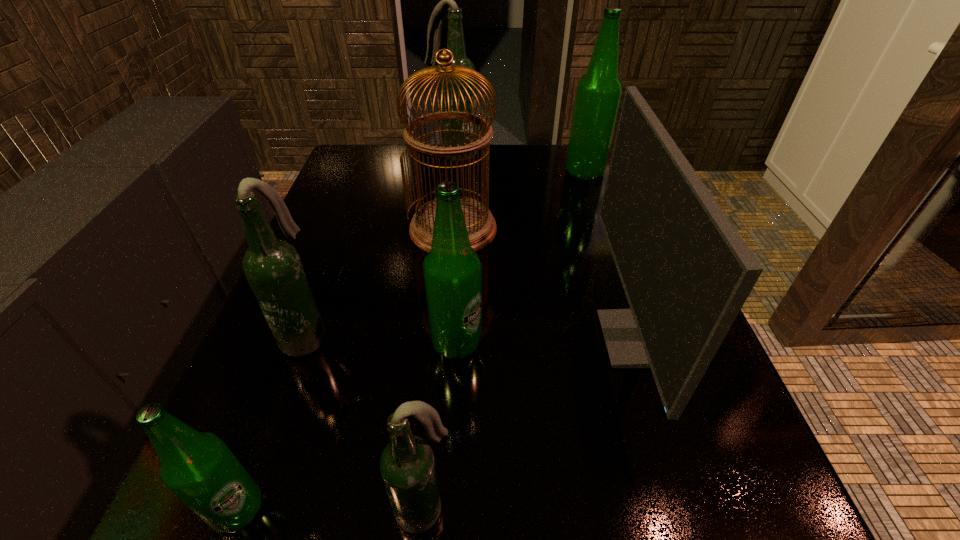
Image resolution: width=960 pixels, height=540 pixels. I want to click on the leftmost green beer bottle, so click(197, 467).

Where is `the nearest dark beer bottle`? This screenshot has height=540, width=960. the nearest dark beer bottle is located at coordinates (407, 465).

Locate an element on the screen. Image resolution: width=960 pixels, height=540 pixels. blank space located 0.300m on the front of the biggest dark beer bottle is located at coordinates (446, 231).

This screenshot has width=960, height=540. What are the coordinates of `vacant region located 0.140m on the label of the rightmost beer bottle` in the screenshot? It's located at (511, 173).

Locate an element on the screen. This screenshot has height=540, width=960. vacant space located on the label of the rightmost beer bottle is located at coordinates (518, 173).

You are a GUI agent. You are given a task and a screenshot of the screen. Output one action in this format:
    pyautogui.click(x=<x>, y=<y>)
    Task: Click on the free location located on the label of the rightmost beer bottle
    Image resolution: width=960 pixels, height=540 pixels.
    Given the screenshot: What is the action you would take?
    pyautogui.click(x=418, y=173)

You are a GUI agent. You are given a task and a screenshot of the screen. Output one action in this format:
    pyautogui.click(x=<x>, y=<y>)
    Task: Click on the vacant point located 0.250m on the front-facing side of the third farthest object
    This screenshot has height=540, width=960.
    Given the screenshot: What is the action you would take?
    pyautogui.click(x=444, y=357)

This screenshot has height=540, width=960. In order to click on vacant region located 0.190m on the front-facing side of the computer monitor in this screenshot , I will do `click(491, 339)`.

Where is `free space located on the front-facing side of the computer monitor`? The width and height of the screenshot is (960, 540). free space located on the front-facing side of the computer monitor is located at coordinates (496, 339).

Locate an element on the screen. free space located 0.180m on the front-facing side of the computer monitor is located at coordinates (496, 339).